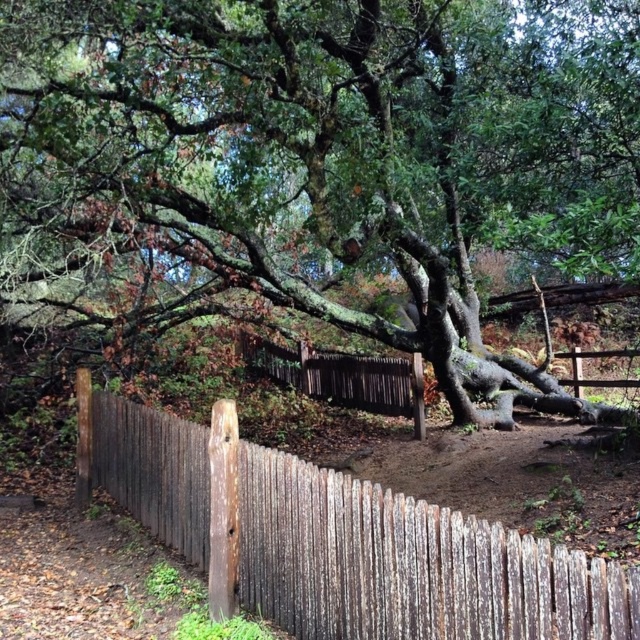
Question: Can you confirm if green mossy tree at center is positioned to the left of weathered wood fence at center?

Choices:
 (A) no
 (B) yes

Answer: (A)

Question: Which of the following is the closest to the observer?

Choices:
 (A) green mossy tree at center
 (B) weathered wood fence at center

Answer: (B)

Question: Can you confirm if green mossy tree at center is positioned below weathered wood fence at center?

Choices:
 (A) yes
 (B) no

Answer: (B)

Question: Is green mossy tree at center bigger than weathered wood fence at center?

Choices:
 (A) no
 (B) yes

Answer: (A)